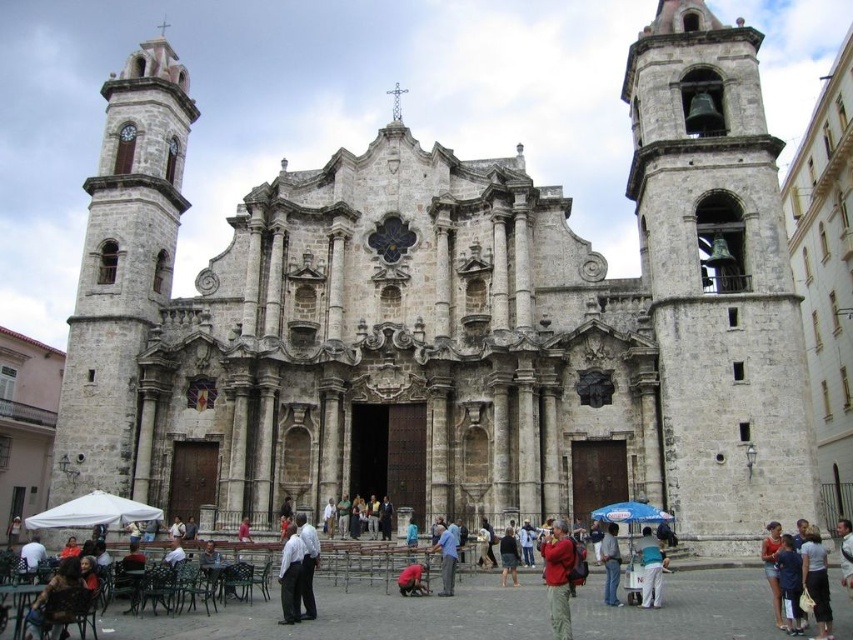
You are standing in front of the historic church and notice a red fabric jacket at center. Where exactly is the red fabric jacket positioned relative to the church facade?

The red fabric jacket at center is located at point coordinates of 0.903 on the x axis and 0.655 on the y axis relative to the church facade.

You are standing at the center of the image. Based on the coordinates provided, is the stone church at right located to your left or right side?

The stone church at right is located at coordinate point 0.431 on the x and 0.970 on the y. Since the x coordinate is less than 0.5, it means it is positioned to the left side from the center. However, the object label says it is at the right. This discrepancy suggests that the coordinate system might have the origin at the bottom left corner, making 0.431 on the x axis still to the right side of the image. Therefore, the stone church at right is indeed on the right side.